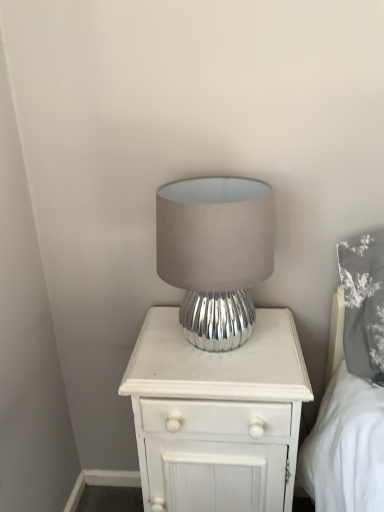
Identify the location of silver metallic lamp at center. (215, 254).

Describe the element at coordinates (215, 254) in the screenshot. I see `silver metallic lamp at center` at that location.

Locate an element on the screen. The width and height of the screenshot is (384, 512). white wood nightstand at center is located at coordinates (217, 415).

The image size is (384, 512). What do you see at coordinates (217, 415) in the screenshot?
I see `white wood nightstand at center` at bounding box center [217, 415].

This screenshot has height=512, width=384. Find the location of `silver metallic lamp at center`. silver metallic lamp at center is located at coordinates (215, 254).

Can you confirm if silver metallic lamp at center is positioned to the right of white wood nightstand at center?

No.

Is silver metallic lamp at center positioned behind white wood nightstand at center?

No, silver metallic lamp at center is in front of white wood nightstand at center.

Considering the points (232, 345) and (250, 362), which point is in front, point (232, 345) or point (250, 362)?

Positioned in front is point (250, 362).

From the image's perspective, which is below, silver metallic lamp at center or white wood nightstand at center?

white wood nightstand at center is shown below in the image.

From a real-world perspective, who is located higher, silver metallic lamp at center or white wood nightstand at center?

silver metallic lamp at center, from a real-world perspective.

Can you confirm if silver metallic lamp at center is thinner than white wood nightstand at center?

Yes.

Who is taller, silver metallic lamp at center or white wood nightstand at center?

white wood nightstand at center.

Considering the sizes of objects silver metallic lamp at center and white wood nightstand at center in the image provided, who is bigger, silver metallic lamp at center or white wood nightstand at center?

With larger size is white wood nightstand at center.

Is silver metallic lamp at center positioned beyond the bounds of white wood nightstand at center?

Yes.

Is silver metallic lamp at center next to white wood nightstand at center?

silver metallic lamp at center and white wood nightstand at center are clearly separated.

Is silver metallic lamp at center positioned with its back to white wood nightstand at center?

That's not correct — silver metallic lamp at center is not looking away from white wood nightstand at center.

What's the angular difference between silver metallic lamp at center and white wood nightstand at center's facing directions?

The angular difference between silver metallic lamp at center and white wood nightstand at center is 1.19 degrees.

Locate an element on the screen. This screenshot has width=384, height=512. nightstand below the silver metallic lamp at center (from a real-world perspective) is located at coordinates (217, 415).

Considering the relative positions of white wood nightstand at center and silver metallic lamp at center in the image provided, is white wood nightstand at center to the left of silver metallic lamp at center from the viewer's perspective?

Incorrect, white wood nightstand at center is not on the left side of silver metallic lamp at center.

Between white wood nightstand at center and silver metallic lamp at center, which one is positioned in front?

silver metallic lamp at center.

Which is in front, point (213, 475) or point (218, 195)?

The point (213, 475) is in front.

From the image's perspective, would you say white wood nightstand at center is positioned over silver metallic lamp at center?

No, from the image's perspective, white wood nightstand at center is not on top of silver metallic lamp at center.

From a real-world perspective, is white wood nightstand at center on top of silver metallic lamp at center?

No.

Can you confirm if white wood nightstand at center is thinner than silver metallic lamp at center?

In fact, white wood nightstand at center might be wider than silver metallic lamp at center.

Who is shorter, white wood nightstand at center or silver metallic lamp at center?

silver metallic lamp at center.

Which of these two, white wood nightstand at center or silver metallic lamp at center, is smaller?

silver metallic lamp at center.

Would you say white wood nightstand at center is outside silver metallic lamp at center?

white wood nightstand at center is positioned outside silver metallic lamp at center.

Is white wood nightstand at center next to silver metallic lamp at center?

No, white wood nightstand at center is not in contact with silver metallic lamp at center.

Is white wood nightstand at center positioned with its back to silver metallic lamp at center?

No, white wood nightstand at center is not facing the opposite direction of silver metallic lamp at center.

Can you tell me how much white wood nightstand at center and silver metallic lamp at center differ in facing direction?

white wood nightstand at center and silver metallic lamp at center are facing 1.19 degrees away from each other.

What are the coordinates of `nightstand that appears on the right of silver metallic lamp at center` in the screenshot? It's located at (217, 415).

Locate an element on the screen. The width and height of the screenshot is (384, 512). lamp above the white wood nightstand at center (from the image's perspective) is located at coordinates (215, 254).

Locate an element on the screen. This screenshot has height=512, width=384. nightstand behind the silver metallic lamp at center is located at coordinates [217, 415].